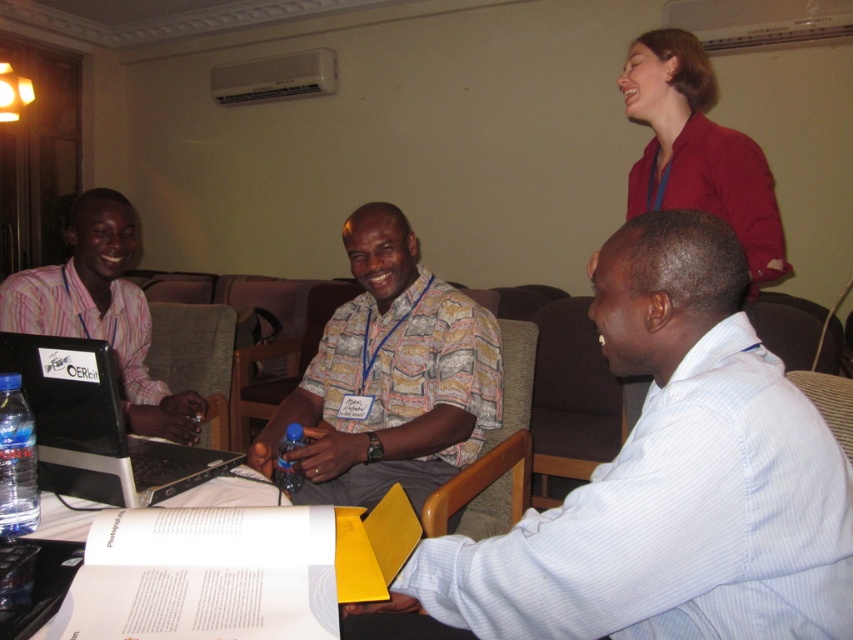
Question: Considering the relative positions of black plastic laptop at left and matte pink shirt at left in the image provided, where is black plastic laptop at left located with respect to matte pink shirt at left?

Choices:
 (A) right
 (B) left

Answer: (A)

Question: Among these objects, which one is farthest from the camera?

Choices:
 (A) blue plastic bottle at center
 (B) printed cotton shirt at center
 (C) matte pink shirt at left

Answer: (C)

Question: Which point appears farthest from the camera in this image?

Choices:
 (A) (679, 129)
 (B) (73, 248)
 (C) (280, 477)

Answer: (B)

Question: Is white striped shirt at center below red matte jacket at upper right?

Choices:
 (A) no
 (B) yes

Answer: (B)

Question: Observing the image, what is the correct spatial positioning of red matte jacket at upper right in reference to black plastic laptop at left?

Choices:
 (A) above
 (B) below

Answer: (A)

Question: Among these points, which one is nearest to the camera?

Choices:
 (A) (283, 484)
 (B) (67, 442)

Answer: (B)